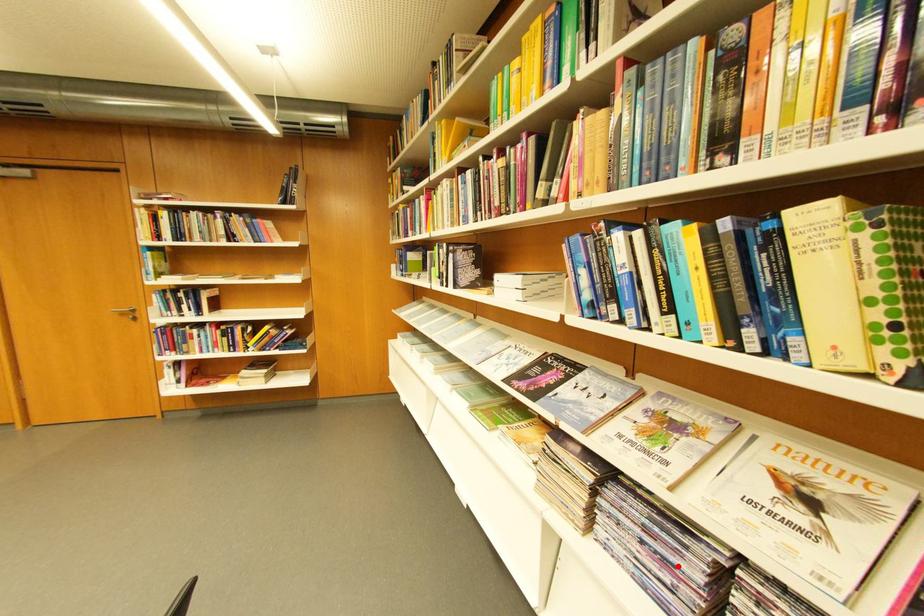
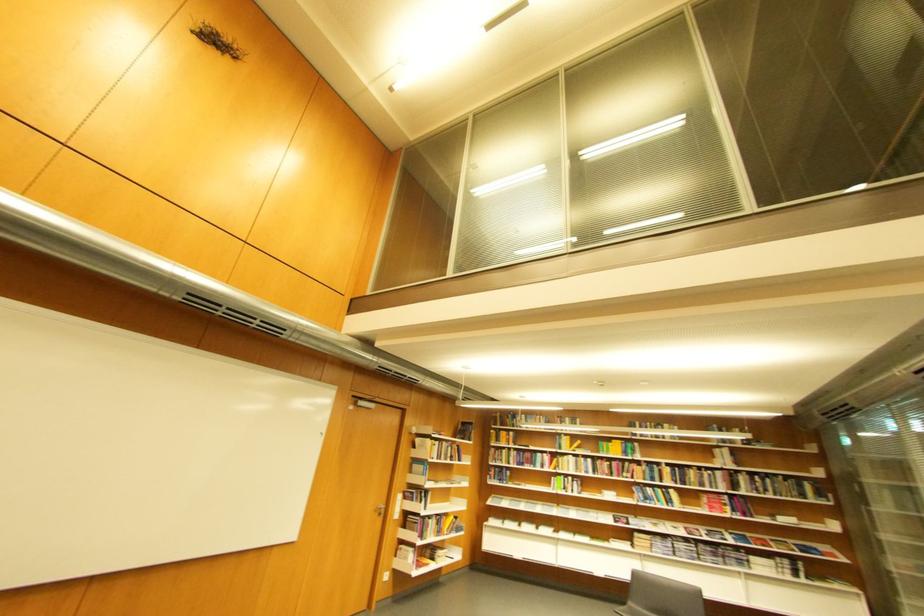
Question: I am providing you with two images of the same scene from different viewpoints. In image1, a red point is highlighted. Considering the same 3D point in image2, which of the following is correct?

Choices:
 (A) It is closer
 (B) It is farther

Answer: (A)